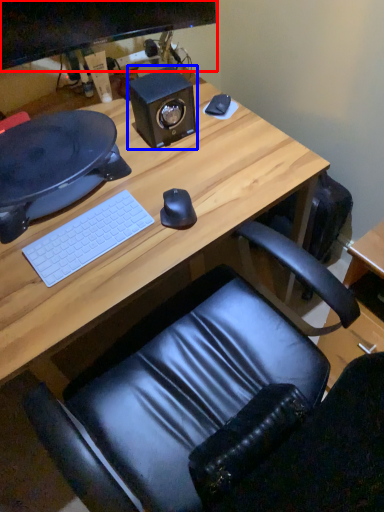
Question: Which point is further to the camera, computer monitor (highlighted by a red box) or speaker (highlighted by a blue box)?

Choices:
 (A) computer monitor
 (B) speaker

Answer: (B)